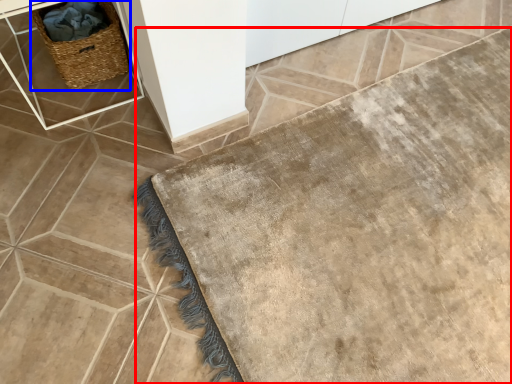
Question: Among these objects, which one is nearest to the camera, bath mat (highlighted by a red box) or picnic basket (highlighted by a blue box)?

Choices:
 (A) bath mat
 (B) picnic basket

Answer: (A)